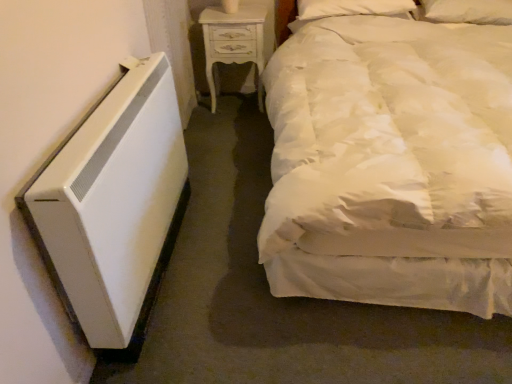
Question: In which direction should I rotate to look at white painted wood nightstand at upper center?

Choices:
 (A) right
 (B) left

Answer: (B)

Question: Does white painted wood nightstand at upper center have a greater width compared to white satin bed at right?

Choices:
 (A) no
 (B) yes

Answer: (A)

Question: From a real-world perspective, is white painted wood nightstand at upper center positioned under white satin bed at right based on gravity?

Choices:
 (A) no
 (B) yes

Answer: (B)

Question: Is white painted wood nightstand at upper center smaller than white satin bed at right?

Choices:
 (A) no
 (B) yes

Answer: (B)

Question: Is white painted wood nightstand at upper center bigger than white satin bed at right?

Choices:
 (A) no
 (B) yes

Answer: (A)

Question: Is white painted wood nightstand at upper center surrounding white satin bed at right?

Choices:
 (A) yes
 (B) no

Answer: (B)

Question: Is white painted wood nightstand at upper center facing towards white satin bed at right?

Choices:
 (A) no
 (B) yes

Answer: (A)

Question: Is the depth of white painted wood nightstand at upper center greater than that of white soft pillow at upper right, which ranks as the second pillow in left-to-right order?

Choices:
 (A) no
 (B) yes

Answer: (B)

Question: From a real-world perspective, is white painted wood nightstand at upper center physically below white soft pillow at upper right, positioned as the 1th pillow in right-to-left order?

Choices:
 (A) yes
 (B) no

Answer: (A)

Question: Does white painted wood nightstand at upper center appear on the left side of white soft pillow at upper right, which ranks as the second pillow in left-to-right order?

Choices:
 (A) no
 (B) yes

Answer: (B)

Question: Is there a large distance between white painted wood nightstand at upper center and white soft pillow at upper right, positioned as the 1th pillow in right-to-left order?

Choices:
 (A) yes
 (B) no

Answer: (A)

Question: Would you say white painted wood nightstand at upper center is outside white soft pillow at upper right, positioned as the 1th pillow in right-to-left order?

Choices:
 (A) yes
 (B) no

Answer: (A)

Question: From the image's perspective, is white painted wood nightstand at upper center below white soft pillow at upper right, positioned as the 1th pillow in right-to-left order?

Choices:
 (A) no
 (B) yes

Answer: (B)

Question: Could you tell me if white soft pillow at upper right, which ranks as the 2th pillow in right-to-left order, is facing white satin bed at right?

Choices:
 (A) yes
 (B) no

Answer: (A)